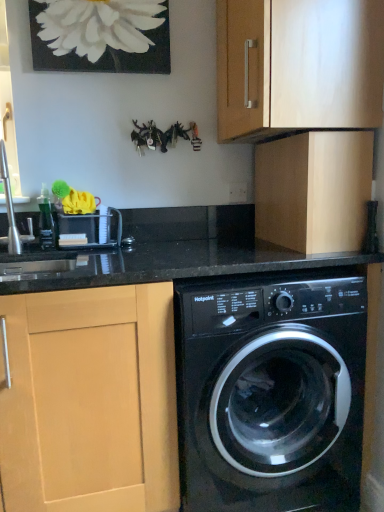
Question: From the image's perspective, is matte wood cabinet at upper center, the third cabinetry ordered from the bottom, over light wood cabinet at upper right, the 2th cabinetry in the top-to-bottom sequence?

Choices:
 (A) yes
 (B) no

Answer: (A)

Question: Is matte wood cabinet at upper center, the third cabinetry ordered from the bottom, facing away from light wood cabinet at upper right, the second cabinetry from the bottom?

Choices:
 (A) no
 (B) yes

Answer: (A)

Question: Considering the relative sizes of matte wood cabinet at upper center, placed as the second cabinetry when sorted from left to right, and light wood cabinet at upper right, which is the 3th cabinetry from left to right, in the image provided, is matte wood cabinet at upper center, placed as the second cabinetry when sorted from left to right, smaller than light wood cabinet at upper right, which is the 3th cabinetry from left to right,?

Choices:
 (A) no
 (B) yes

Answer: (A)

Question: Is matte wood cabinet at upper center, which is counted as the 1th cabinetry, starting from the top, further to the viewer compared to light wood cabinet at upper right, the 1th cabinetry when ordered from right to left?

Choices:
 (A) no
 (B) yes

Answer: (A)

Question: Can you confirm if matte wood cabinet at upper center, acting as the 2th cabinetry starting from the right, is positioned to the left of light wood cabinet at upper right, which is the 3th cabinetry from left to right?

Choices:
 (A) no
 (B) yes

Answer: (B)

Question: From a real-world perspective, is matte wood cabinet at upper center, placed as the second cabinetry when sorted from left to right, positioned under light wood cabinet at upper right, which is the 3th cabinetry from left to right, based on gravity?

Choices:
 (A) no
 (B) yes

Answer: (A)

Question: From the image's perspective, does matte wood cabinet at upper center, acting as the 2th cabinetry starting from the right, appear higher than brushed metal faucet at left?

Choices:
 (A) yes
 (B) no

Answer: (A)

Question: Is brushed metal faucet at left a part of matte wood cabinet at upper center, the third cabinetry ordered from the bottom?

Choices:
 (A) no
 (B) yes

Answer: (A)

Question: From a real-world perspective, is matte wood cabinet at upper center, placed as the second cabinetry when sorted from left to right, physically below brushed metal faucet at left?

Choices:
 (A) yes
 (B) no

Answer: (B)

Question: Does matte wood cabinet at upper center, placed as the second cabinetry when sorted from left to right, have a smaller size compared to brushed metal faucet at left?

Choices:
 (A) yes
 (B) no

Answer: (B)

Question: Is matte wood cabinet at upper center, which is counted as the 1th cabinetry, starting from the top, not close to brushed metal faucet at left?

Choices:
 (A) yes
 (B) no

Answer: (B)

Question: From the image's perspective, is matte wood cabinet at upper center, the third cabinetry ordered from the bottom, located beneath brushed metal faucet at left?

Choices:
 (A) yes
 (B) no

Answer: (B)

Question: Would you say light wood cabinet at left, which ranks as the first cabinetry in bottom-to-top order, is part of matte wood cabinet at upper center, acting as the 2th cabinetry starting from the right,'s contents?

Choices:
 (A) yes
 (B) no

Answer: (B)